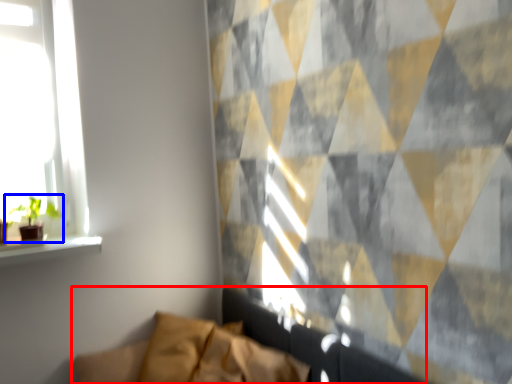
Question: Which point is further to the camera, couch (highlighted by a red box) or houseplant (highlighted by a blue box)?

Choices:
 (A) couch
 (B) houseplant

Answer: (B)